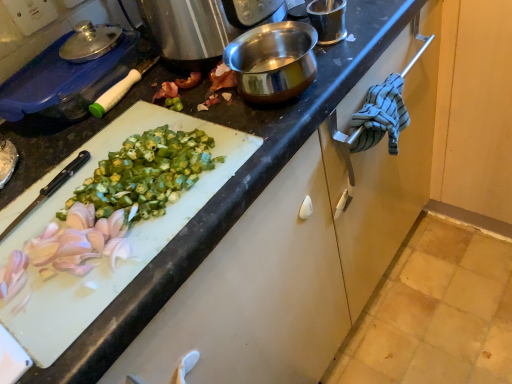
Question: Can you see white glossy cutting board at center-left touching blue plastic container at upper left?

Choices:
 (A) no
 (B) yes

Answer: (A)

Question: Could you tell me if white glossy cutting board at center-left is facing blue plastic container at upper left?

Choices:
 (A) no
 (B) yes

Answer: (A)

Question: Does white glossy cutting board at center-left have a larger size compared to blue plastic container at upper left?

Choices:
 (A) no
 (B) yes

Answer: (B)

Question: Can you confirm if white glossy cutting board at center-left is thinner than blue plastic container at upper left?

Choices:
 (A) no
 (B) yes

Answer: (A)

Question: From the image's perspective, is white glossy cutting board at center-left over blue plastic container at upper left?

Choices:
 (A) yes
 (B) no

Answer: (B)

Question: Based on their sizes in the image, would you say blue plastic container at upper left is bigger or smaller than white glossy cutting board at center-left?

Choices:
 (A) small
 (B) big

Answer: (A)

Question: From the image's perspective, is blue plastic container at upper left above or below white glossy cutting board at center-left?

Choices:
 (A) below
 (B) above

Answer: (B)

Question: Considering the positions of blue plastic container at upper left and white glossy cutting board at center-left in the image, is blue plastic container at upper left wider or thinner than white glossy cutting board at center-left?

Choices:
 (A) wide
 (B) thin

Answer: (B)

Question: From their relative heights in the image, would you say blue plastic container at upper left is taller or shorter than white glossy cutting board at center-left?

Choices:
 (A) short
 (B) tall

Answer: (A)

Question: Does point (125, 59) appear closer or farther from the camera than point (388, 112)?

Choices:
 (A) closer
 (B) farther

Answer: (B)

Question: Looking at the image, does blue plastic container at upper left seem bigger or smaller compared to blue striped cloth at right?

Choices:
 (A) big
 (B) small

Answer: (A)

Question: Considering the positions of blue plastic container at upper left and blue striped cloth at right in the image, is blue plastic container at upper left taller or shorter than blue striped cloth at right?

Choices:
 (A) short
 (B) tall

Answer: (A)

Question: In the image, is blue plastic container at upper left positioned in front of or behind blue striped cloth at right?

Choices:
 (A) front
 (B) behind

Answer: (A)

Question: Is point (402, 124) closer or farther from the camera than point (81, 178)?

Choices:
 (A) farther
 (B) closer

Answer: (A)

Question: Considering the positions of blue striped cloth at right and white glossy cutting board at center-left in the image, is blue striped cloth at right taller or shorter than white glossy cutting board at center-left?

Choices:
 (A) tall
 (B) short

Answer: (A)